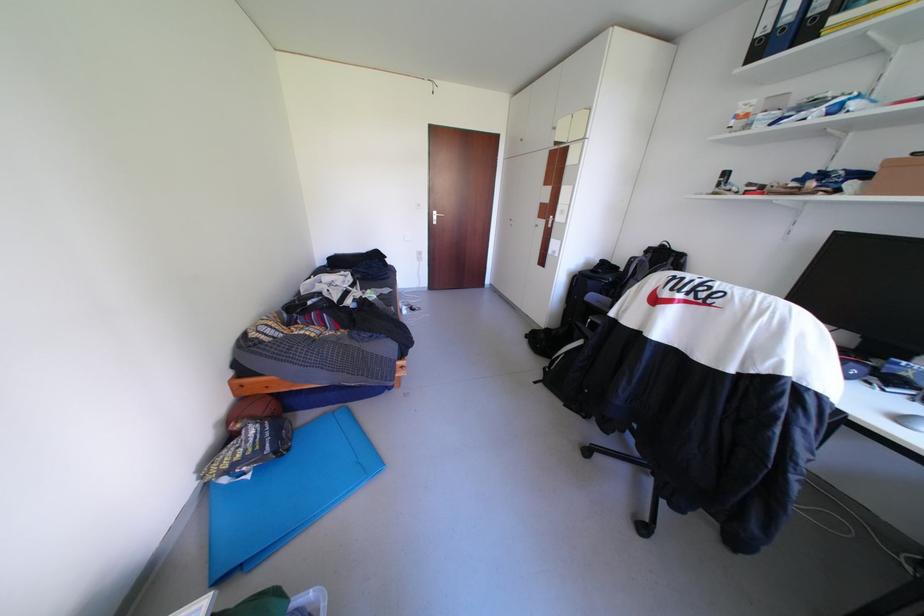
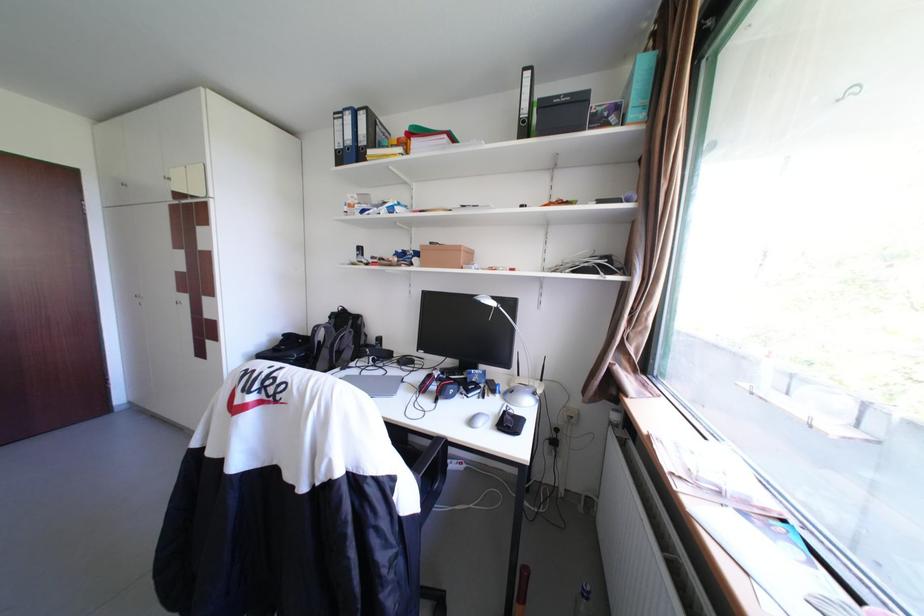
Find the pixel in the second image that matches point (771, 50) in the first image.

(351, 158)